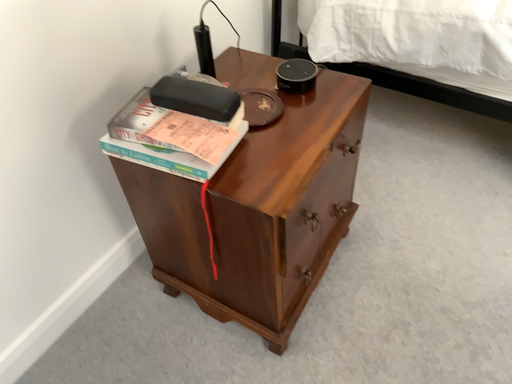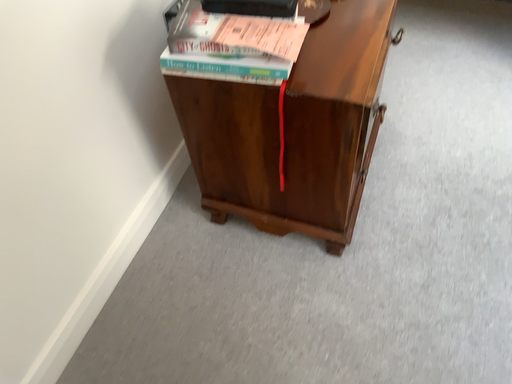
Question: How did the camera likely rotate when shooting the video?

Choices:
 (A) rotated right
 (B) rotated left

Answer: (A)